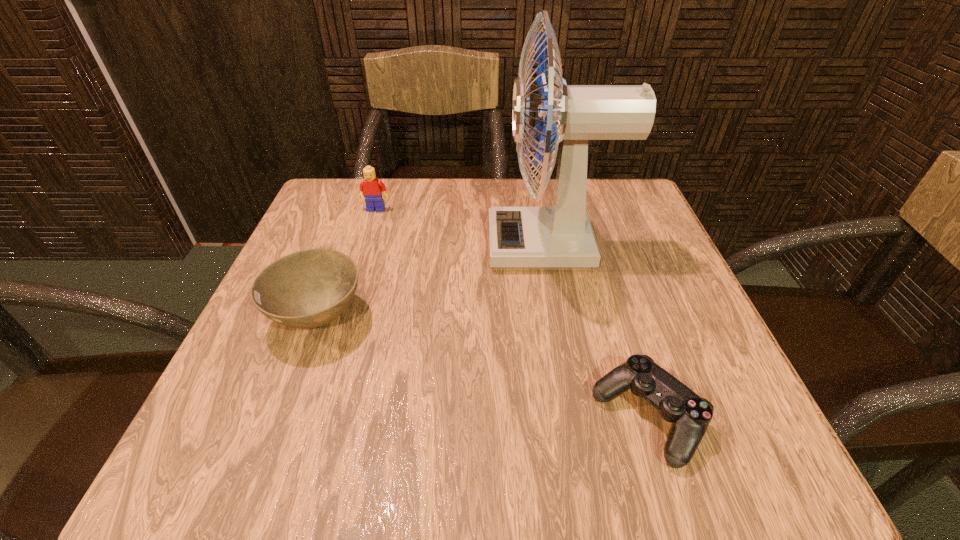
Locate an element on the screen. The width and height of the screenshot is (960, 540). vacant point located between the fan and the Lego is located at coordinates (464, 228).

Locate an element on the screen. The width and height of the screenshot is (960, 540). free space between the nearest object and the tallest object is located at coordinates (599, 332).

You are a GUI agent. You are given a task and a screenshot of the screen. Output one action in this format:
    pyautogui.click(x=<x>, y=<y>)
    Task: Click on the free area in between the Lego and the tallest object
    The image size is (960, 540).
    Given the screenshot: What is the action you would take?
    pyautogui.click(x=464, y=228)

This screenshot has height=540, width=960. Find the location of `vacant space that is in between the fan and the Lego`. vacant space that is in between the fan and the Lego is located at coordinates (464, 228).

You are a GUI agent. You are given a task and a screenshot of the screen. Output one action in this format:
    pyautogui.click(x=<x>, y=<y>)
    Task: Click on the unoccupied position between the third tallest object and the fan
    
    Given the screenshot: What is the action you would take?
    pyautogui.click(x=435, y=281)

Find the location of a particular element. The width and height of the screenshot is (960, 540). vacant space that is in between the nearest object and the third shortest object is located at coordinates (x=512, y=314).

Locate which object is the second closest to the fan. Please provide its 2D coordinates. Your answer should be formatted as a tuple, i.e. [(x, y)], where the tuple contains the x and y coordinates of a point satisfying the conditions above.

[(310, 288)]

Identify which object is the nearest to the Lego. Please provide its 2D coordinates. Your answer should be formatted as a tuple, i.e. [(x, y)], where the tuple contains the x and y coordinates of a point satisfying the conditions above.

[(559, 237)]

Locate an element on the screen. vacant space that satisfies the following two spatial constraints: 1. on the front-facing side of the nearest object; 2. on the left side of the fan is located at coordinates (584, 418).

Identify the location of blank area in the image that satisfies the following two spatial constraints: 1. on the face of the Lego; 2. on the right side of the control. Image resolution: width=960 pixels, height=540 pixels. (310, 418).